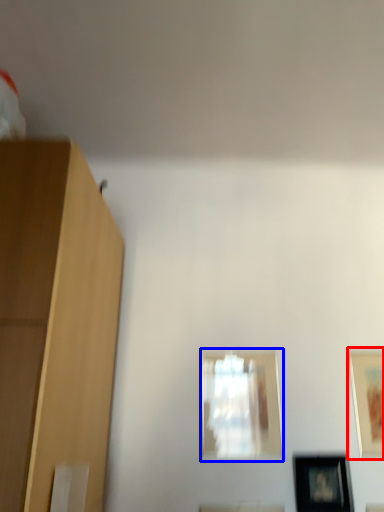
Question: Which point is closer to the camera, picture frame (highlighted by a red box) or picture frame (highlighted by a blue box)?

Choices:
 (A) picture frame
 (B) picture frame

Answer: (A)